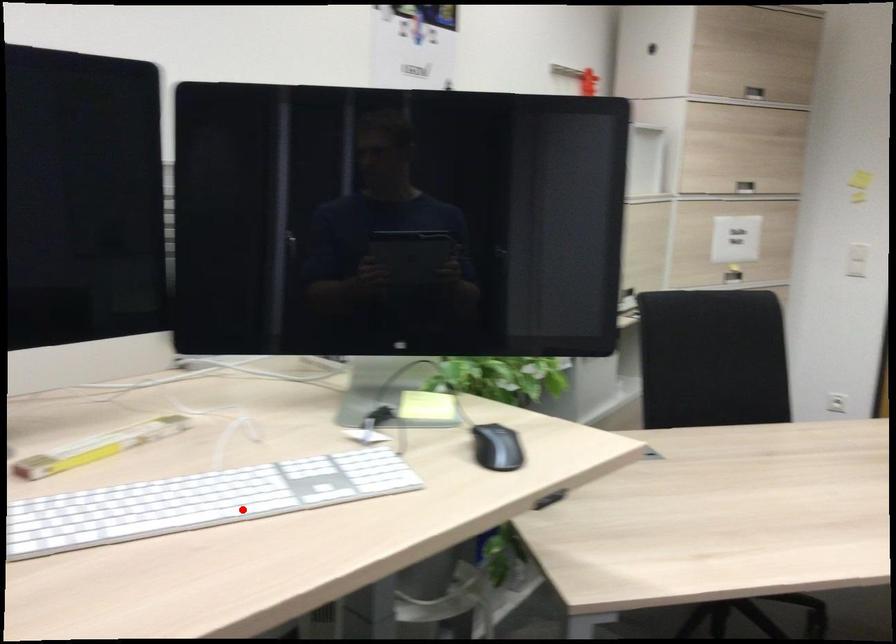
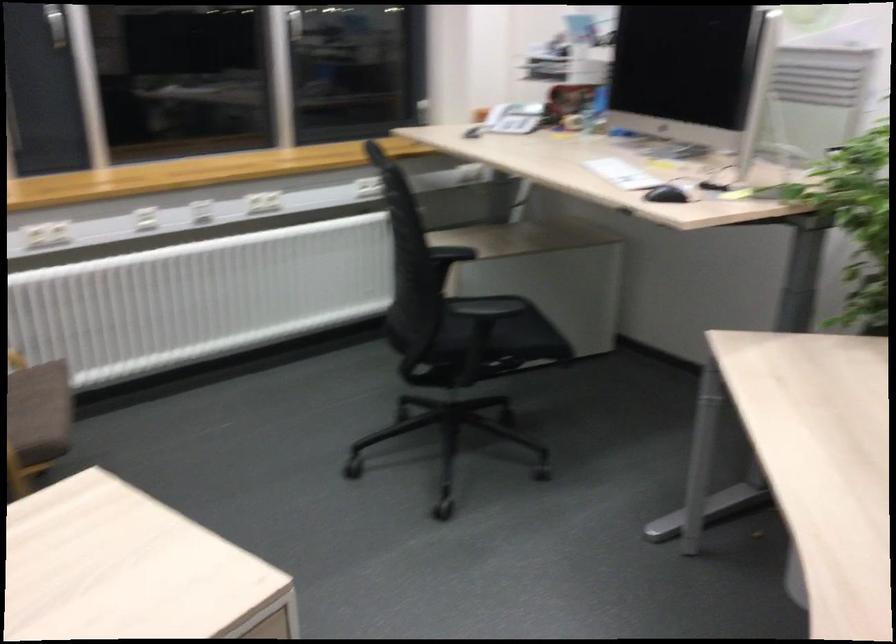
Question: I am providing you with two images of the same scene from different viewpoints. Image1 has a red point marked. In image2, the corresponding 3D location appears at what relative position? Reply with the corresponding letter.

Choices:
 (A) Closer
 (B) Farther

Answer: (B)